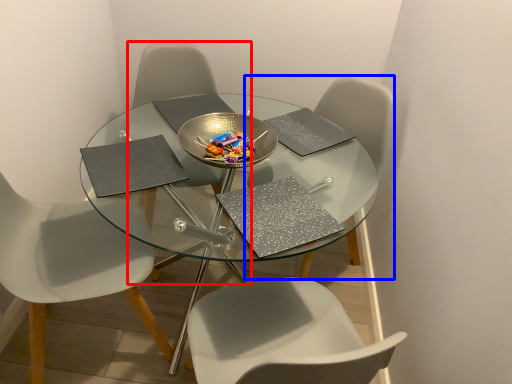
Question: Which object is closer to the camera taking this photo, chair (highlighted by a red box) or chair (highlighted by a blue box)?

Choices:
 (A) chair
 (B) chair

Answer: (B)